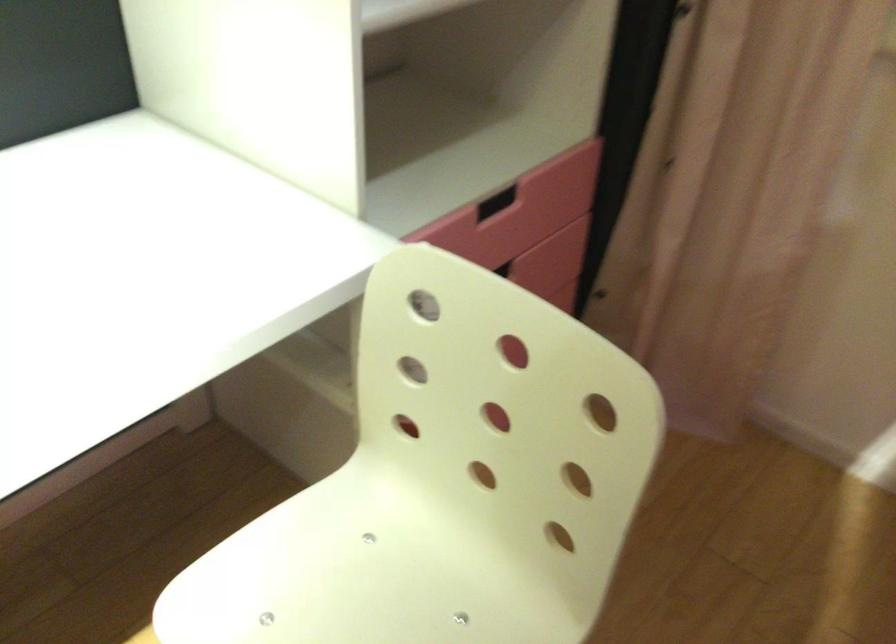
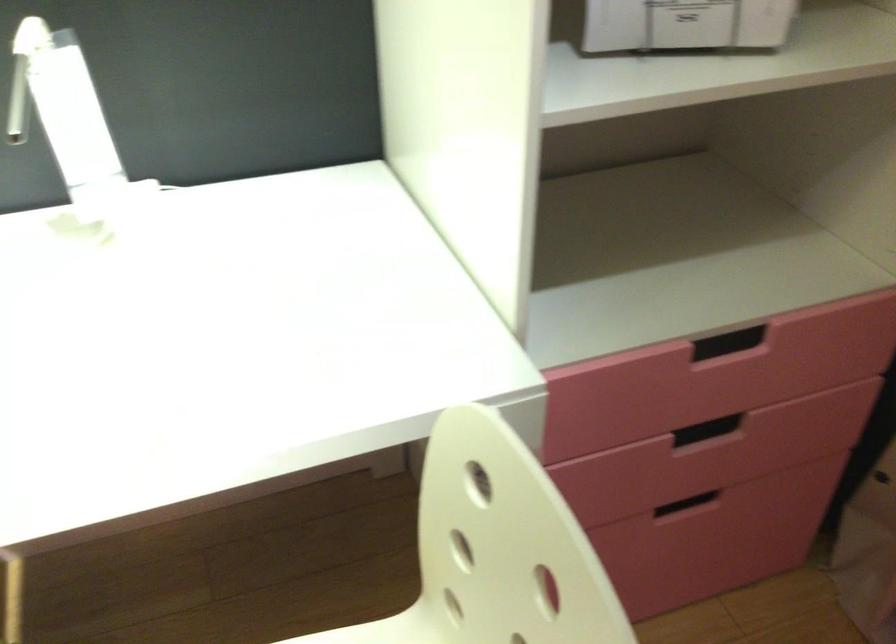
The point at (510, 212) is marked in the first image. Where is the corresponding point in the second image?

(743, 355)